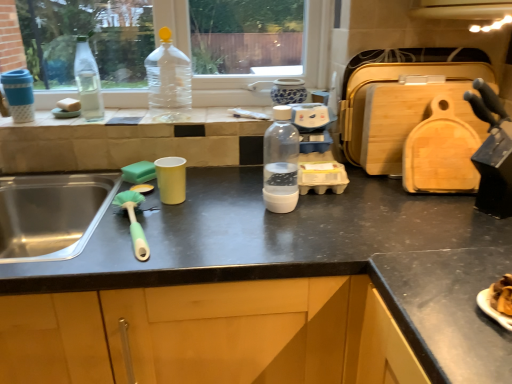
Question: Should I look upward or downward to see clear glass bottle at left, which is the third bottle in front-to-back order?

Choices:
 (A) up
 (B) down

Answer: (A)

Question: From a real-world perspective, is clear glass bottle at left, which is counted as the 1th bottle, starting from the left, below matte black countertop at center?

Choices:
 (A) yes
 (B) no

Answer: (B)

Question: Can we say clear glass bottle at left, which is the third bottle in front-to-back order, lies outside matte black countertop at center?

Choices:
 (A) no
 (B) yes

Answer: (B)

Question: Considering the relative positions of clear glass bottle at left, which is the third bottle from right to left, and matte black countertop at center in the image provided, is clear glass bottle at left, which is the third bottle from right to left, behind matte black countertop at center?

Choices:
 (A) yes
 (B) no

Answer: (A)

Question: Is clear glass bottle at left, which is the third bottle in front-to-back order, facing towards matte black countertop at center?

Choices:
 (A) yes
 (B) no

Answer: (B)

Question: Is clear glass bottle at left, which is the third bottle in front-to-back order, oriented away from matte black countertop at center?

Choices:
 (A) yes
 (B) no

Answer: (B)

Question: Is clear glass bottle at left, which is the third bottle in front-to-back order, at the right side of matte black countertop at center?

Choices:
 (A) yes
 (B) no

Answer: (B)

Question: Can you confirm if matte black countertop at center is wider than clear glass bottle at left, which is the third bottle in front-to-back order?

Choices:
 (A) yes
 (B) no

Answer: (A)

Question: Considering the relative sizes of matte black countertop at center and clear glass bottle at left, which is the third bottle from right to left, in the image provided, is matte black countertop at center shorter than clear glass bottle at left, which is the third bottle from right to left,?

Choices:
 (A) no
 (B) yes

Answer: (A)

Question: Considering the relative sizes of matte black countertop at center and clear glass bottle at left, which is counted as the 1th bottle, starting from the left, in the image provided, is matte black countertop at center thinner than clear glass bottle at left, which is counted as the 1th bottle, starting from the left,?

Choices:
 (A) yes
 (B) no

Answer: (B)

Question: From a real-world perspective, is matte black countertop at center on top of clear glass bottle at left, which is counted as the 1th bottle, starting from the left?

Choices:
 (A) yes
 (B) no

Answer: (B)

Question: Is matte black countertop at center further to camera compared to clear glass bottle at left, the 1th bottle from the back?

Choices:
 (A) no
 (B) yes

Answer: (A)

Question: Are matte black countertop at center and clear glass bottle at left, which is the third bottle in front-to-back order, far apart?

Choices:
 (A) yes
 (B) no

Answer: (B)

Question: Is green plastic brush at left at the right side of clear glass bottle at left, the 1th bottle from the back?

Choices:
 (A) no
 (B) yes

Answer: (B)